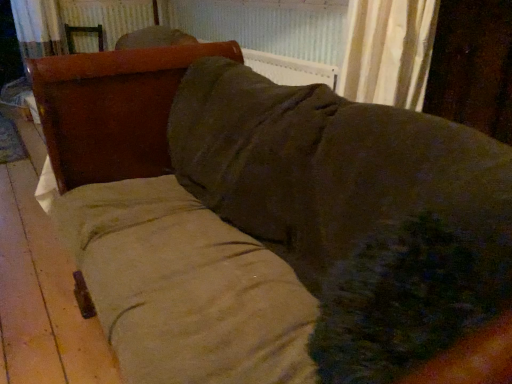
I want to click on dark green fabric at center, so click(x=413, y=305).

The width and height of the screenshot is (512, 384). What do you see at coordinates (413, 305) in the screenshot? I see `dark green fabric at center` at bounding box center [413, 305].

At what (x,y) coordinates should I click in order to perform the action: click on dark green fabric at center. Please return your answer as a coordinate pair (x, y). The height and width of the screenshot is (384, 512). Looking at the image, I should click on (413, 305).